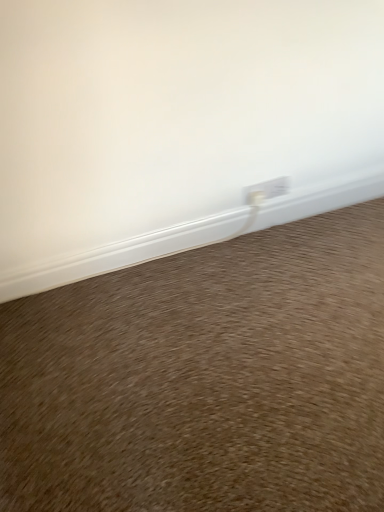
Question: Which is correct: brown carpet at lower center is inside white plastic window sill at lower center, or outside of it?

Choices:
 (A) outside
 (B) inside

Answer: (A)

Question: Is brown carpet at lower center wider or thinner than white plastic window sill at lower center?

Choices:
 (A) wide
 (B) thin

Answer: (A)

Question: Is point (248, 485) closer or farther from the camera than point (175, 244)?

Choices:
 (A) farther
 (B) closer

Answer: (B)

Question: Based on their sizes in the image, would you say white plastic window sill at lower center is bigger or smaller than brown carpet at lower center?

Choices:
 (A) small
 (B) big

Answer: (A)

Question: Is white plastic window sill at lower center inside the boundaries of brown carpet at lower center, or outside?

Choices:
 (A) outside
 (B) inside

Answer: (A)

Question: From the image's perspective, relative to brown carpet at lower center, is white plastic window sill at lower center above or below?

Choices:
 (A) below
 (B) above

Answer: (B)

Question: From a real-world perspective, relative to brown carpet at lower center, is white plastic window sill at lower center vertically above or below?

Choices:
 (A) above
 (B) below

Answer: (A)